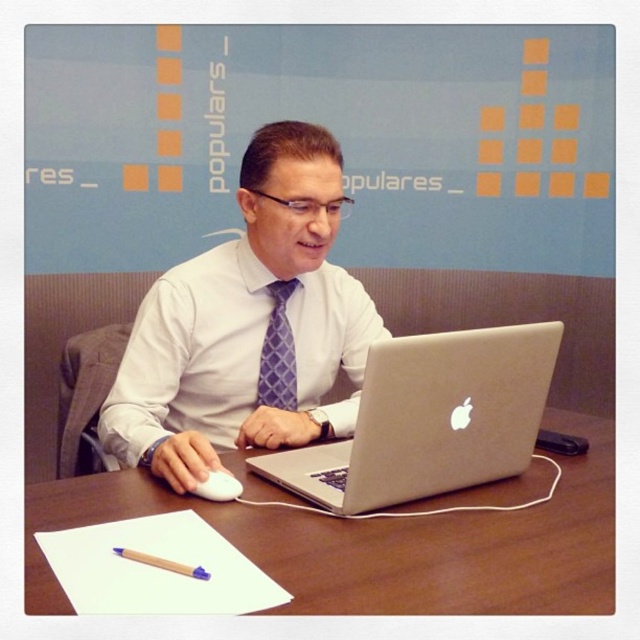
Question: Is wooden table at center closer to camera compared to white matte mouse at lower left?

Choices:
 (A) no
 (B) yes

Answer: (B)

Question: Which point is farther to the camera?

Choices:
 (A) white matte mouse at lower left
 (B) purple textured tie at center
 (C) wooden table at center

Answer: (B)

Question: Considering the real-world distances, which object is farthest from the white glossy shirt at center?

Choices:
 (A) purple textured tie at center
 (B) wooden pencil at lower left
 (C) silver metallic laptop at center

Answer: (B)

Question: Which point is farther from the camera taking this photo?

Choices:
 (A) (188, 566)
 (B) (186, 486)
 (C) (266, 333)
 (D) (234, 497)

Answer: (C)

Question: Is white glossy shirt at center below white matte mouse at lower left?

Choices:
 (A) no
 (B) yes

Answer: (A)

Question: Can you confirm if white glossy shirt at center is positioned to the right of wooden table at center?

Choices:
 (A) no
 (B) yes

Answer: (A)